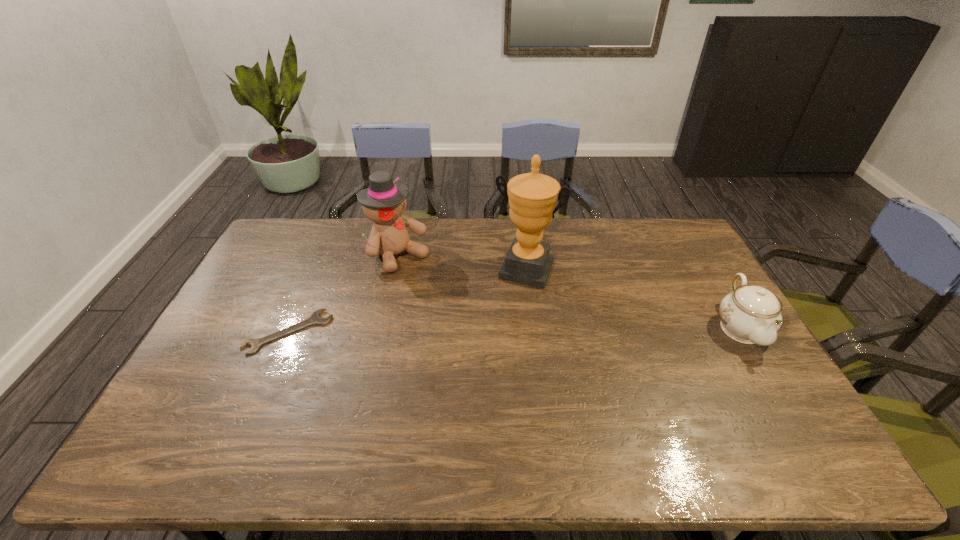
Image resolution: width=960 pixels, height=540 pixels. What are the coordinates of `wrench` in the screenshot? It's located at (315, 318).

Image resolution: width=960 pixels, height=540 pixels. I want to click on the shortest object, so click(315, 318).

The height and width of the screenshot is (540, 960). In order to click on the second shortest object in this screenshot , I will do `click(750, 314)`.

Locate an element on the screen. This screenshot has height=540, width=960. the rightmost object is located at coordinates (750, 314).

Image resolution: width=960 pixels, height=540 pixels. I want to click on award, so click(532, 197).

Where is `the tallest object`? This screenshot has width=960, height=540. the tallest object is located at coordinates (532, 197).

Where is `rag_doll`? The height and width of the screenshot is (540, 960). rag_doll is located at coordinates (384, 202).

Image resolution: width=960 pixels, height=540 pixels. I want to click on the second tallest object, so click(384, 202).

Identify the location of free region located on the back of the wrench. Image resolution: width=960 pixels, height=540 pixels. (302, 300).

The image size is (960, 540). I want to click on vacant position located 0.080m at the spout of the rightmost object, so click(x=774, y=384).